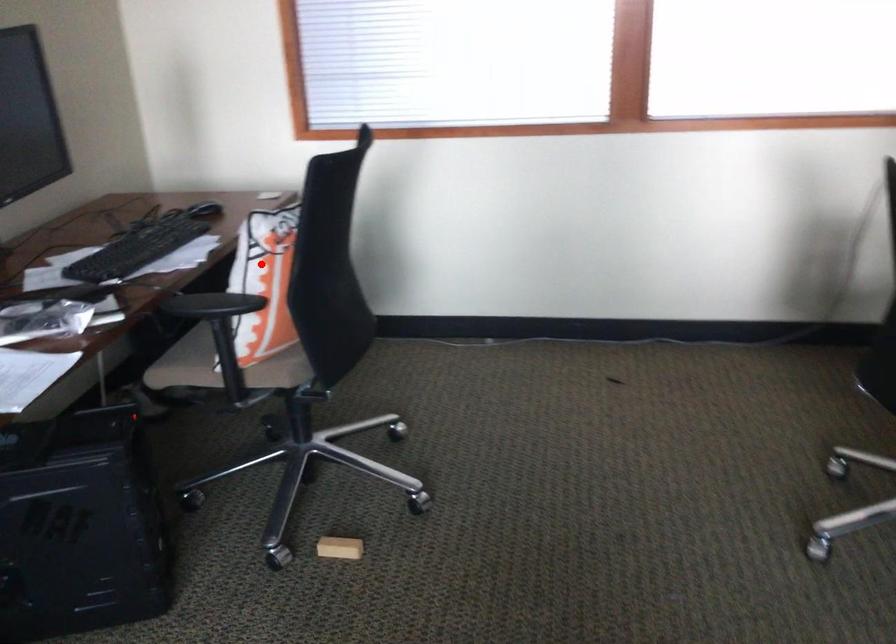
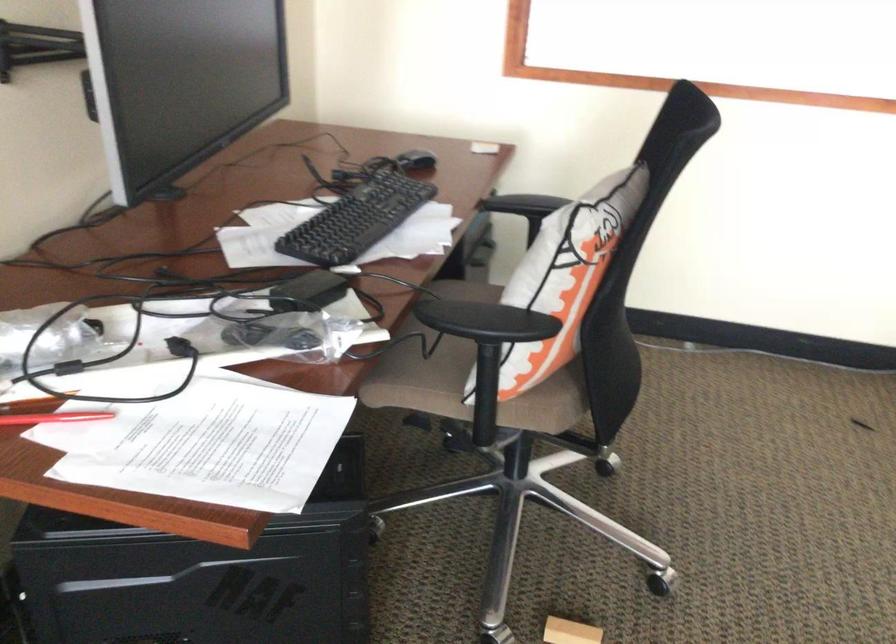
Question: I am providing you with two images of the same scene from different viewpoints. A red point is shown in image1. For the corresponding object point in image2, is it positioned nearer or farther from the camera?

Choices:
 (A) Nearer
 (B) Farther

Answer: (A)